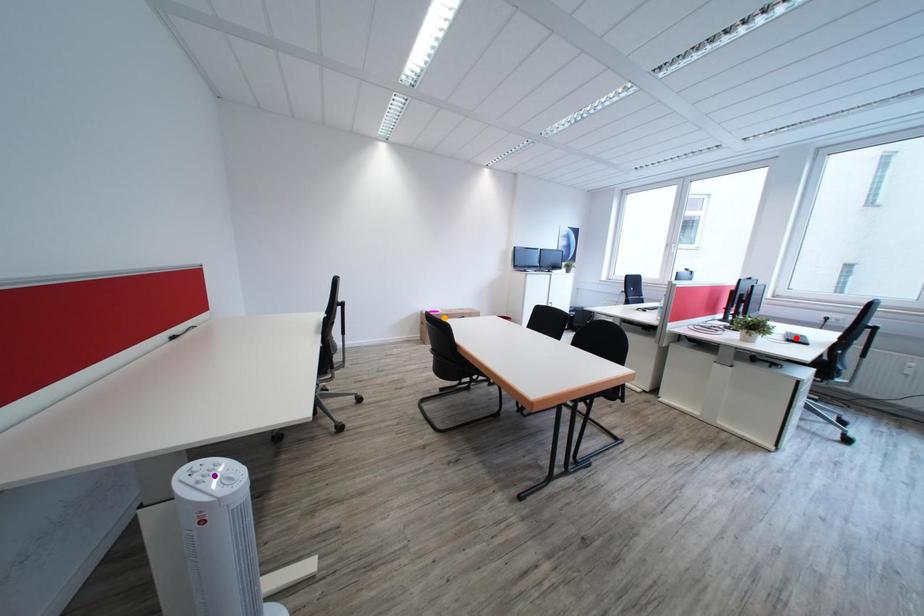
Order these from nearest to farthest:
red point | orange point | purple point

purple point
red point
orange point